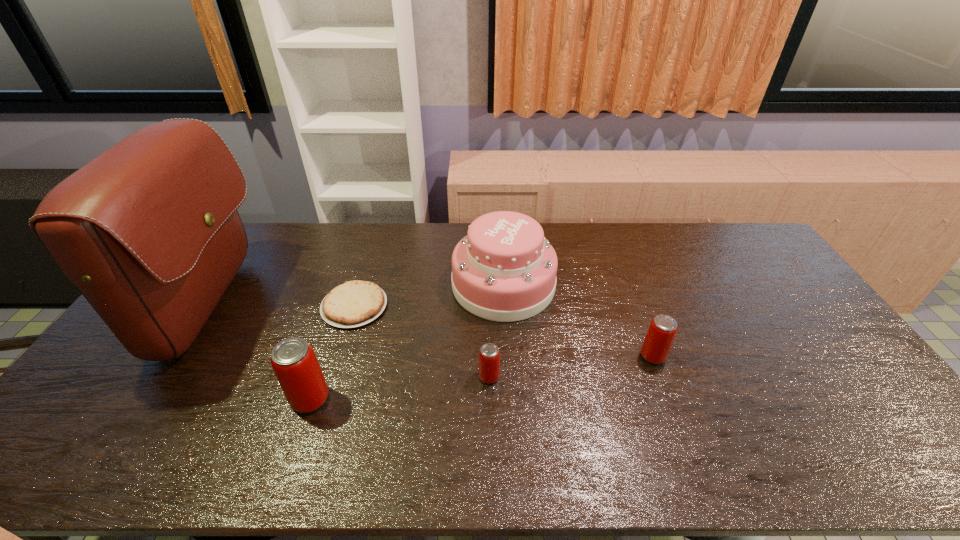
What are the coordinates of `the third tallest object` in the screenshot? It's located at (294, 362).

Locate an element on the screen. Image resolution: width=960 pixels, height=540 pixels. the tallest beer can is located at coordinates (294, 362).

You are a GUI agent. You are given a task and a screenshot of the screen. Output one action in this format:
    pyautogui.click(x=<x>, y=<y>)
    Task: Click on the second beer can from right to left
    The height and width of the screenshot is (540, 960).
    Given the screenshot: What is the action you would take?
    pyautogui.click(x=489, y=355)

Identify the location of the shortest beer can. This screenshot has height=540, width=960. (489, 355).

The width and height of the screenshot is (960, 540). I want to click on the rightmost object, so click(660, 336).

Image resolution: width=960 pixels, height=540 pixels. Identify the location of the rightmost beer can. (660, 336).

Where is `the tallest object`? the tallest object is located at coordinates (148, 231).

Identify the location of the leftmost object. (148, 231).

In order to click on the shortest object in this screenshot , I will do `click(355, 303)`.

Find the location of `the fifth shortest object`. the fifth shortest object is located at coordinates (504, 270).